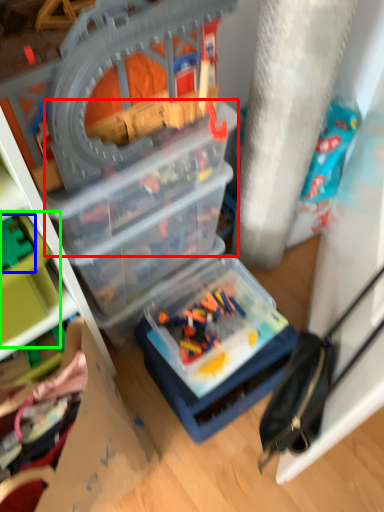
Question: Which object is positioned farthest from box (highlighted by a red box)? Select from toy (highlighted by a blue box) and toy (highlighted by a green box).

Choices:
 (A) toy
 (B) toy

Answer: (A)